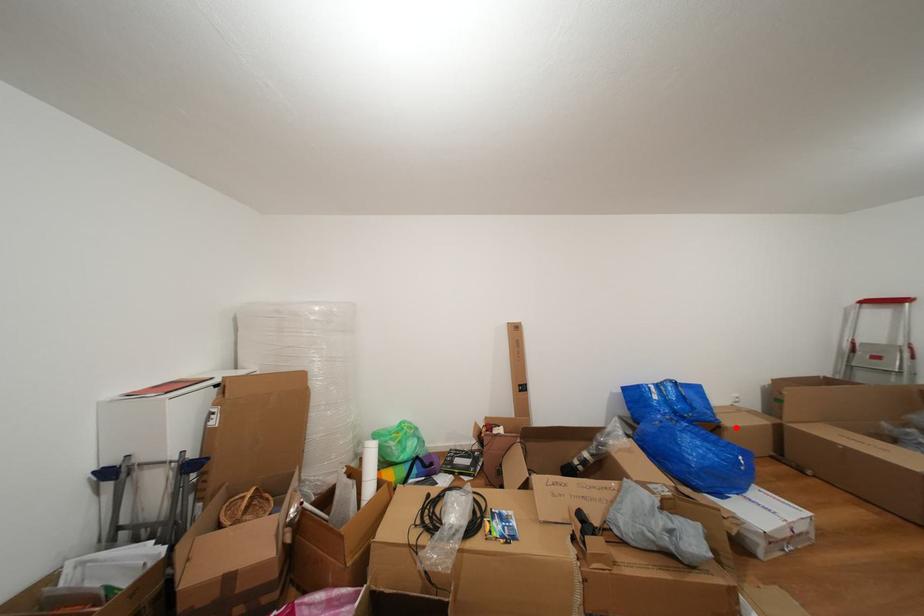
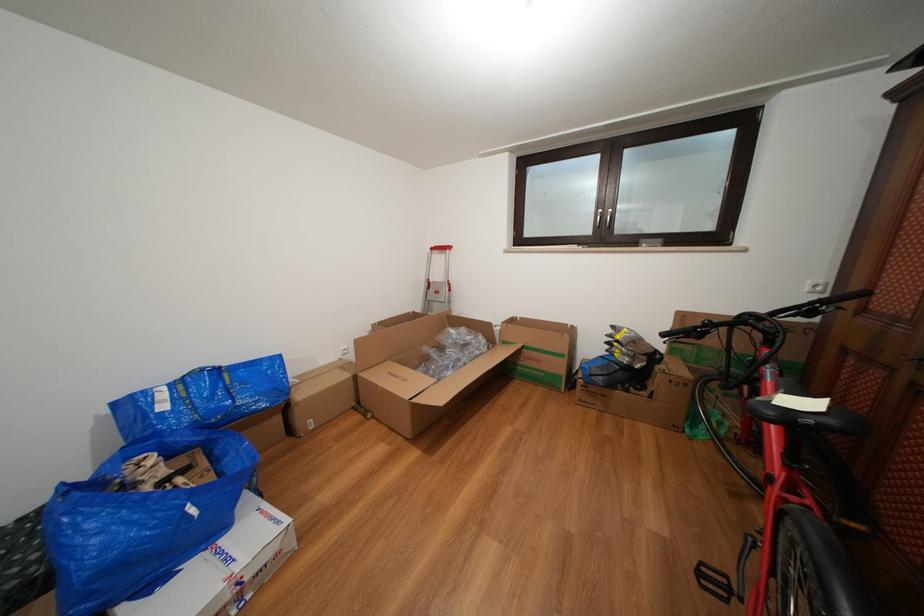
Find the pixel in the second image that matches the highlighted location in the first image.

(309, 400)